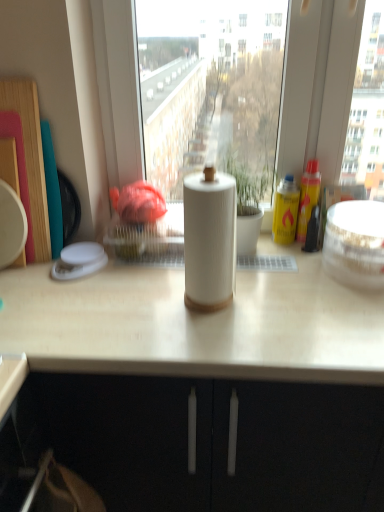
Question: Does point (350, 209) appear closer or farther from the camera than point (289, 297)?

Choices:
 (A) farther
 (B) closer

Answer: (A)

Question: Considering the relative positions of white glossy bowl at right, placed as the 1th appliance when sorted from right to left, and white matte paper towel holder at center in the image provided, is white glossy bowl at right, placed as the 1th appliance when sorted from right to left, to the left or to the right of white matte paper towel holder at center?

Choices:
 (A) right
 (B) left

Answer: (A)

Question: Which is farther from the white plastic container at left, the 2th appliance in the right-to-left sequence?

Choices:
 (A) white matte paper towel holder at center
 (B) white matte paper towel at center
 (C) white glossy bowl at right, which is the 2th appliance from left to right

Answer: (C)

Question: Which of these objects is positioned closest to the white matte paper towel at center?

Choices:
 (A) white matte paper towel holder at center
 (B) white glossy bowl at right, which is the 2th appliance from left to right
 (C) white plastic container at left, the 2th appliance in the right-to-left sequence

Answer: (A)